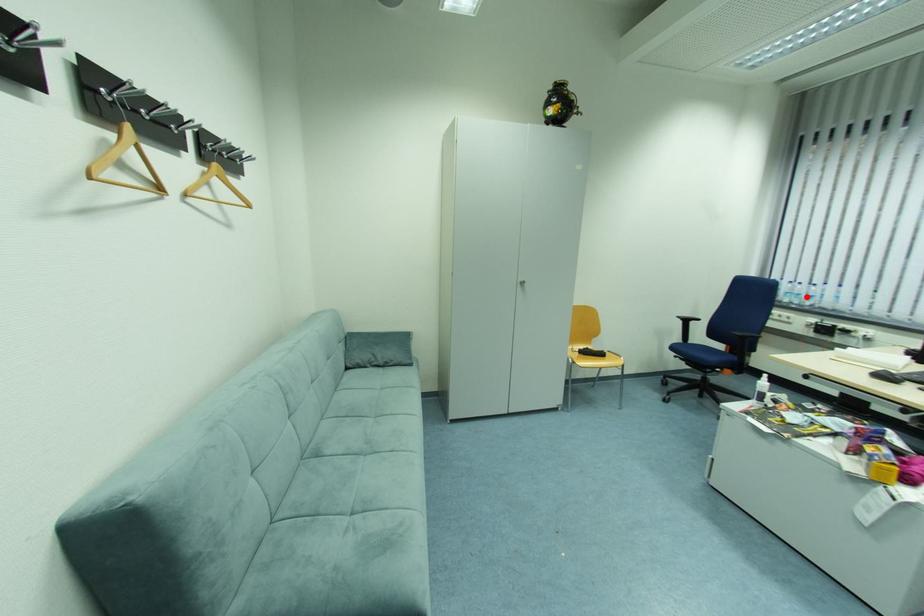
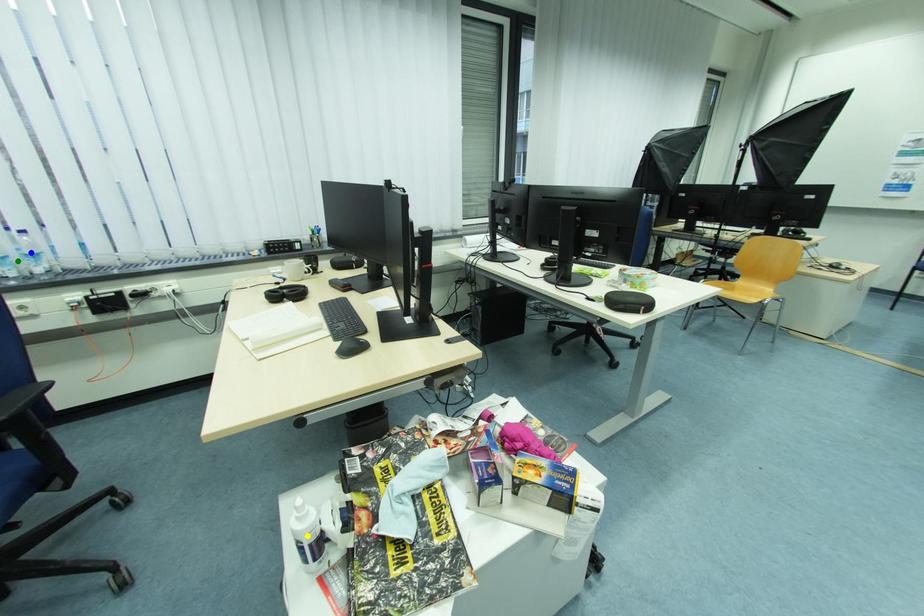
Question: I am providing you with two images of the same scene from different viewpoints. A red point is marked on the first image. You are given multiple points on the second image. Which spot in image 2 lines up with the point in image 1?

Choices:
 (A) blue point
 (B) green point
 (C) yellow point

Answer: (B)